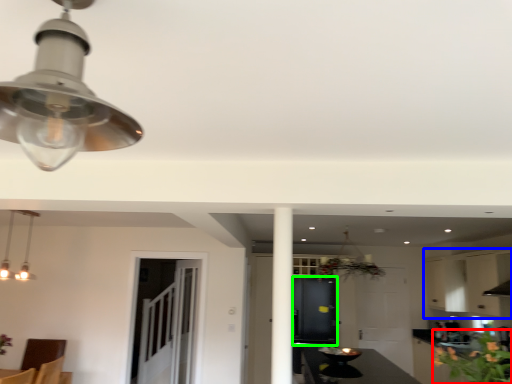
Question: Based on their relative distances, which object is farther from flower (highlighted by a red box)? Choose from cabinetry (highlighted by a blue box) and cabinetry (highlighted by a green box).

Choices:
 (A) cabinetry
 (B) cabinetry

Answer: (A)